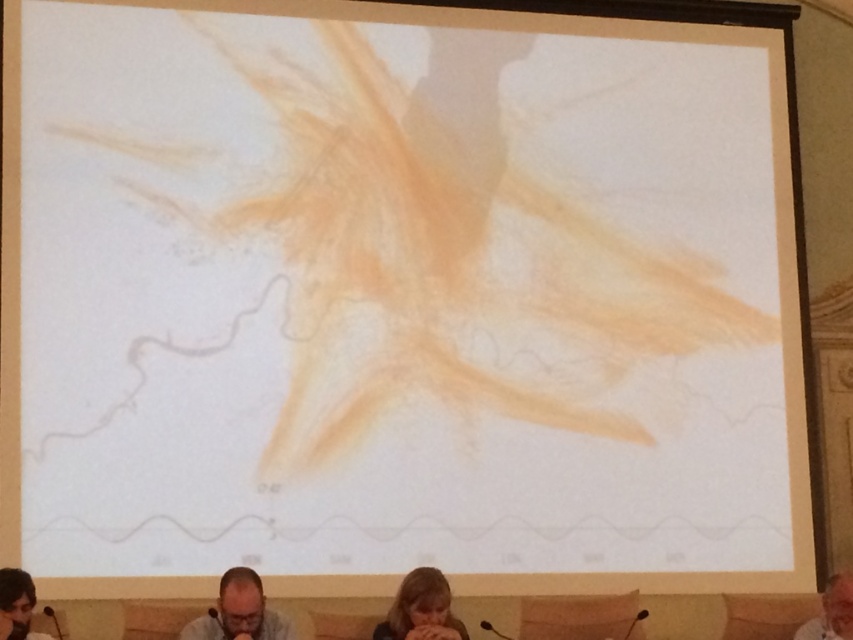
You are a speaker at a conference. You see the matte black microphone at lower left and the gray hair at lower right. Which object is located to the left of the other?

The matte black microphone at lower left is positioned on the left side of gray hair at lower right.